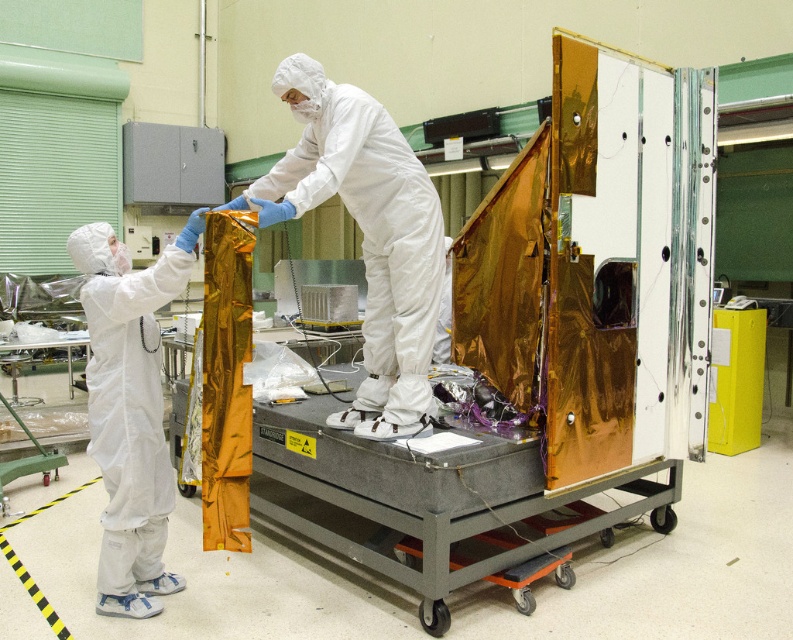
Based on the photo, is white matte suit at center positioned before white matte suit at left?

That is True.

Which is in front, point (374, 413) or point (125, 372)?

Point (125, 372) is more forward.

You are a GUI agent. You are given a task and a screenshot of the screen. Output one action in this format:
    pyautogui.click(x=<x>, y=<y>)
    Task: Click on the white matte suit at center
    
    Given the screenshot: What is the action you would take?
    pyautogui.click(x=366, y=236)